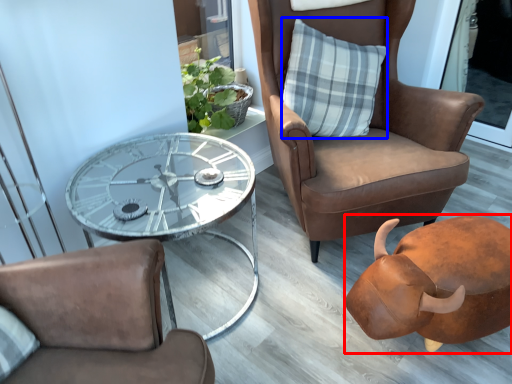
Question: Which object appears farthest to the camera in this image, piggy bank (highlighted by a red box) or pillow (highlighted by a blue box)?

Choices:
 (A) piggy bank
 (B) pillow

Answer: (B)